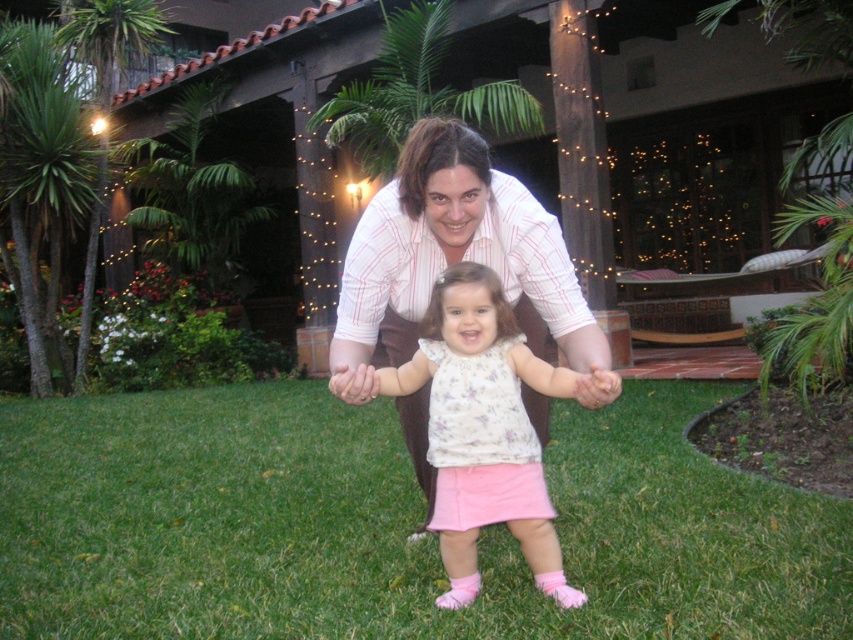
Question: Can you confirm if green grass at center is bigger than light pink cotton dress at center?

Choices:
 (A) yes
 (B) no

Answer: (B)

Question: Which of the following is the farthest from the observer?

Choices:
 (A) (473, 458)
 (B) (647, 636)

Answer: (A)

Question: Can you confirm if green grass at center is positioned to the right of light pink cotton dress at center?

Choices:
 (A) no
 (B) yes

Answer: (A)

Question: Is green grass at center positioned in front of light pink cotton dress at center?

Choices:
 (A) yes
 (B) no

Answer: (B)

Question: Which of the following is the farthest from the observer?

Choices:
 (A) green grass at center
 (B) light pink cotton dress at center

Answer: (A)

Question: Which point appears farthest from the camera in this image?

Choices:
 (A) (306, 496)
 (B) (468, 483)

Answer: (A)